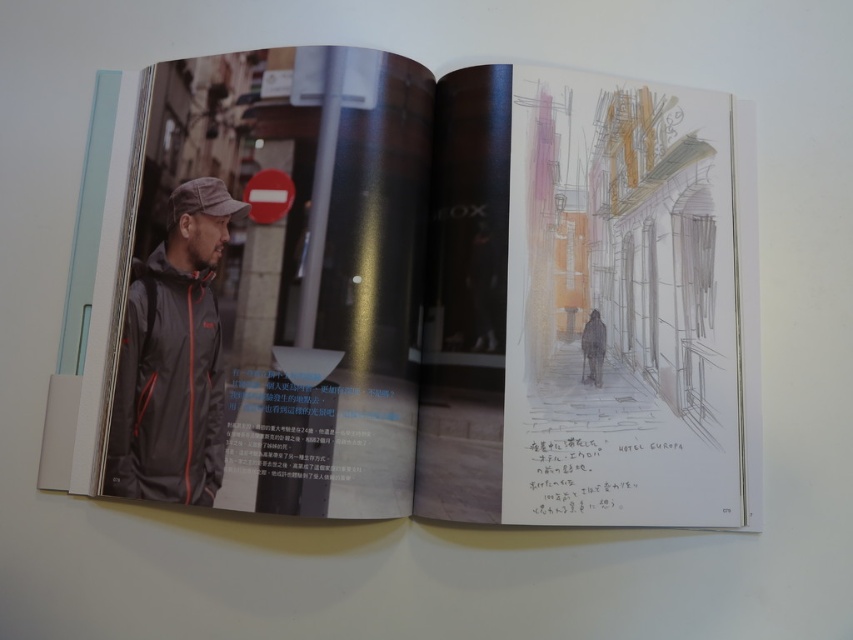
Question: Is matte black jacket at left below dark gray matte jacket at left?

Choices:
 (A) yes
 (B) no

Answer: (B)

Question: Can you confirm if matte black jacket at left is smaller than dark gray matte jacket at left?

Choices:
 (A) no
 (B) yes

Answer: (A)

Question: Can you confirm if matte black jacket at left is positioned to the right of dark gray matte jacket at left?

Choices:
 (A) yes
 (B) no

Answer: (A)

Question: Which of the following is the farthest from the observer?

Choices:
 (A) matte black jacket at left
 (B) dark gray matte jacket at left

Answer: (B)

Question: Among these points, which one is farthest from the camera?

Choices:
 (A) (212, 385)
 (B) (131, 305)

Answer: (B)